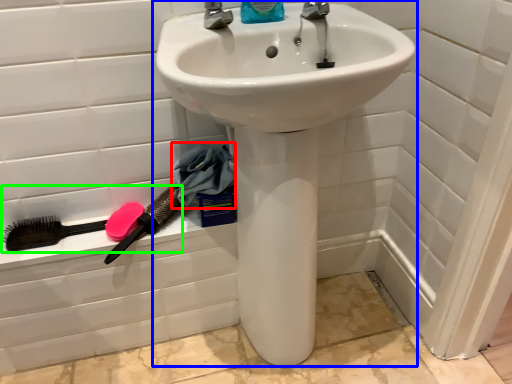
Question: Which object is positioned closest to material (highlighted by a red box)? Select from sink (highlighted by a blue box) and brush (highlighted by a green box).

Choices:
 (A) sink
 (B) brush

Answer: (B)